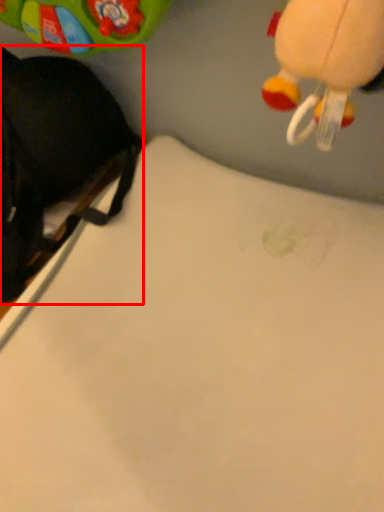
Question: From the image's perspective, what is the correct spatial relationship of toy (annotated by the red box) in relation to sheet?

Choices:
 (A) below
 (B) above

Answer: (B)